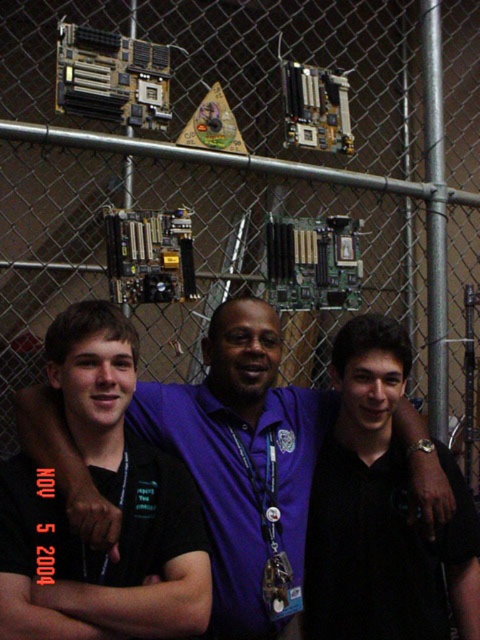
Question: Where is purple shirt at center located in relation to black matte shirt at center in the image?

Choices:
 (A) left
 (B) right

Answer: (B)

Question: Which point is farther to the camera?

Choices:
 (A) (206, 420)
 (B) (154, 568)

Answer: (A)

Question: Does purple shirt at center have a larger size compared to black matte shirt at center?

Choices:
 (A) yes
 (B) no

Answer: (A)

Question: Which object appears closest to the camera in this image?

Choices:
 (A) black matte shirt at center
 (B) purple shirt at center

Answer: (A)

Question: Which point appears closest to the camera in this image?

Choices:
 (A) (2, 499)
 (B) (304, 518)

Answer: (A)

Question: Does purple shirt at center have a smaller size compared to black matte shirt at center?

Choices:
 (A) yes
 (B) no

Answer: (B)